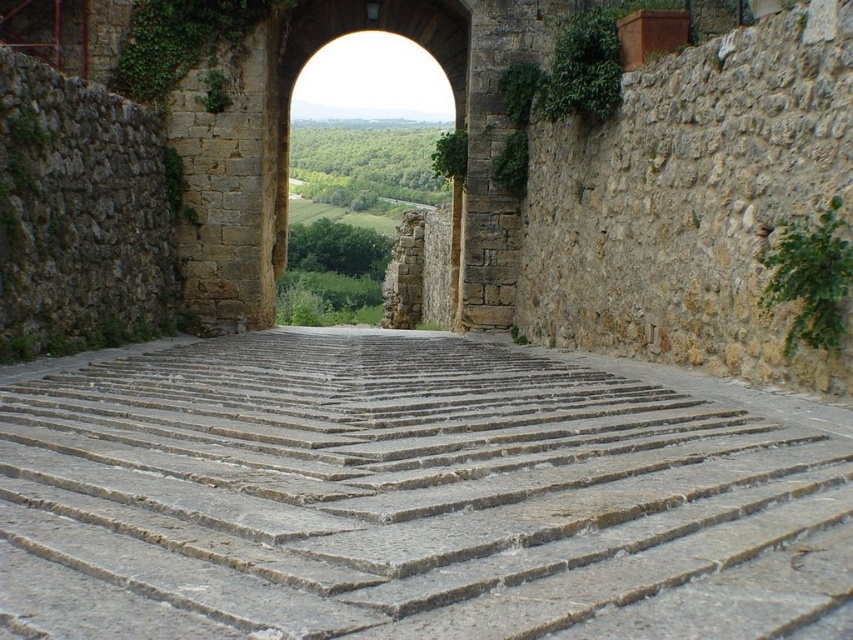
Question: Which point is closer to the camera?

Choices:
 (A) green leafy ivy at right
 (B) stone archway at center

Answer: (A)

Question: Which of the following is the closest to the observer?

Choices:
 (A) green leafy ivy at right
 (B) gray stone stairs at center

Answer: (B)

Question: Is gray stone stairs at center closer to camera compared to green leafy ivy at right?

Choices:
 (A) yes
 (B) no

Answer: (A)

Question: Which point is closer to the camera taking this photo?

Choices:
 (A) (720, 397)
 (B) (461, 17)

Answer: (A)

Question: Can you confirm if gray stone stairs at center is bigger than stone archway at center?

Choices:
 (A) yes
 (B) no

Answer: (B)

Question: From the image, what is the correct spatial relationship of gray stone stairs at center in relation to green leafy ivy at right?

Choices:
 (A) left
 (B) right

Answer: (A)